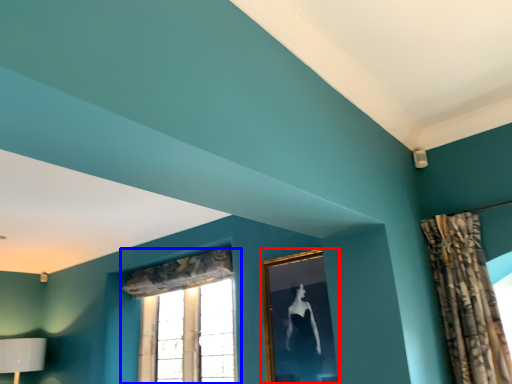
Question: Which point is further to the camera, picture frame (highlighted by a red box) or window (highlighted by a blue box)?

Choices:
 (A) picture frame
 (B) window

Answer: (B)